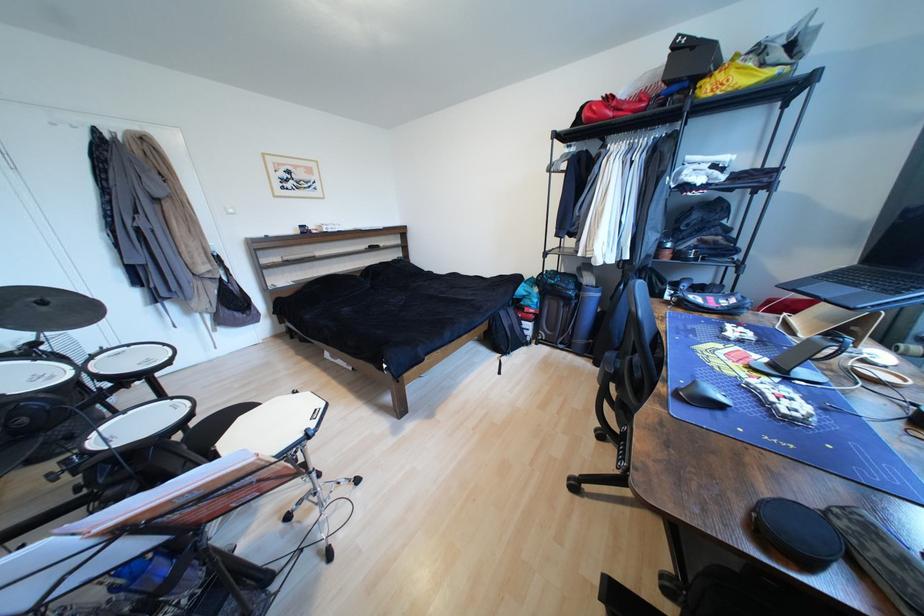
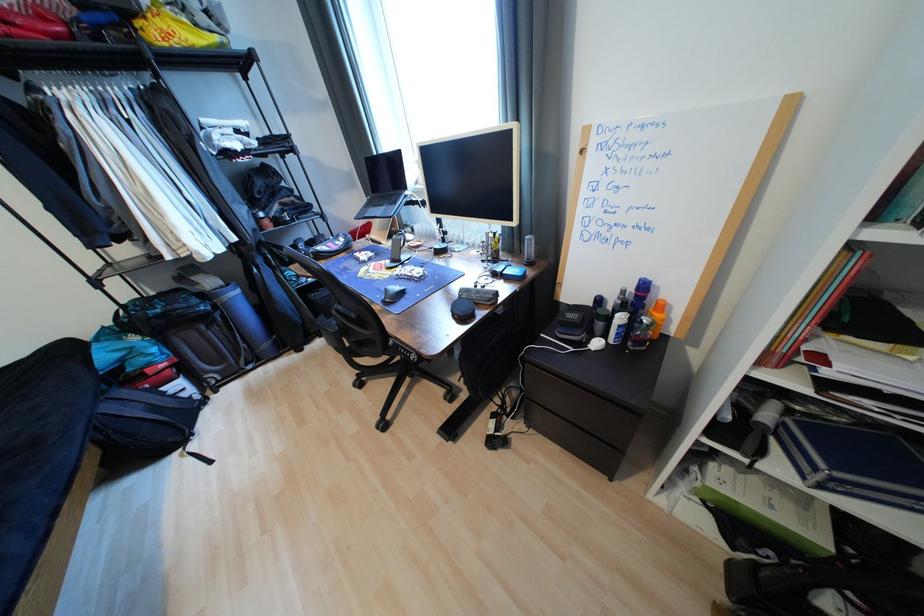
Locate, in the second image, the point that corresponds to the point at 782,73 in the first image.

(223, 39)